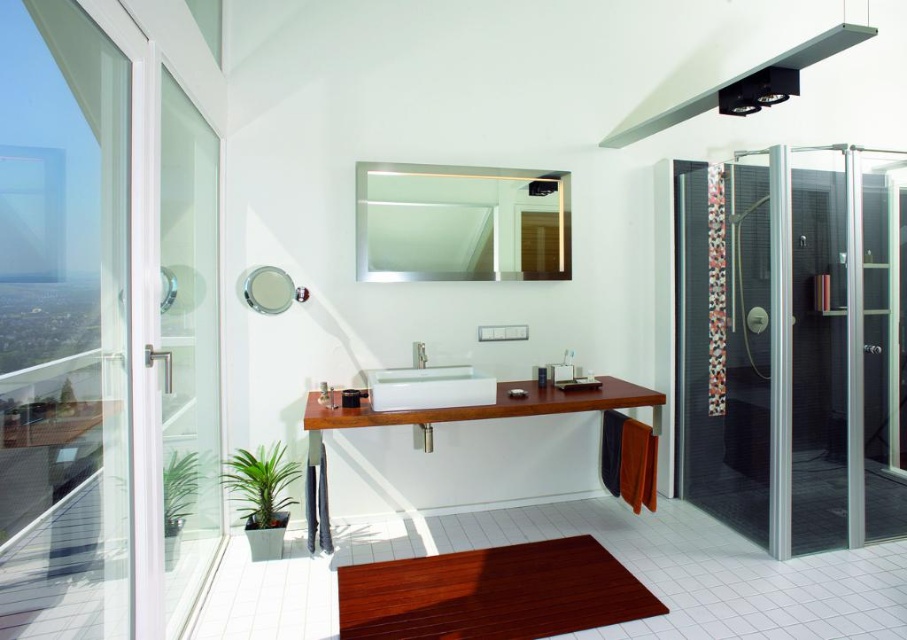
Question: Can you confirm if transparent glass shower door at right is positioned to the left of white glossy sink at center?

Choices:
 (A) no
 (B) yes

Answer: (A)

Question: Can you confirm if transparent glass shower door at right is positioned to the right of teak wood vanity at center?

Choices:
 (A) no
 (B) yes

Answer: (B)

Question: Among these objects, which one is nearest to the camera?

Choices:
 (A) teak wood vanity at center
 (B) transparent glass shower door at right
 (C) satin nickel faucet at center

Answer: (A)

Question: Which object is farther from the camera taking this photo?

Choices:
 (A) white glossy sink at center
 (B) satin nickel faucet at center
 (C) teak wood vanity at center

Answer: (B)

Question: Is transparent glass shower door at right wider than teak wood vanity at center?

Choices:
 (A) no
 (B) yes

Answer: (A)

Question: Which of the following is the closest to the observer?

Choices:
 (A) white glossy sink at center
 (B) satin nickel faucet at center
 (C) transparent glass shower door at right
 (D) teak wood vanity at center

Answer: (D)